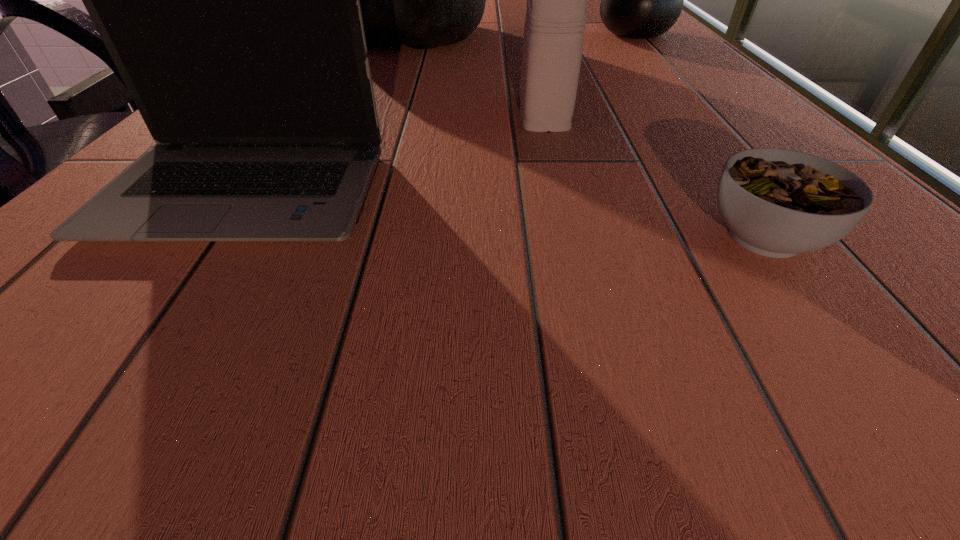
The image size is (960, 540). What are the coordinates of `vacant area that lies between the soup bowl and the second tallest object` in the screenshot? It's located at (700, 136).

The width and height of the screenshot is (960, 540). What are the coordinates of `empty space between the soup bowl and the third object from right to left` in the screenshot? It's located at (654, 174).

The height and width of the screenshot is (540, 960). I want to click on vacant region between the detergent and the laptop computer, so click(394, 153).

Identify the location of free area in between the soup bowl and the third object from right to left. (654, 174).

Identify the location of free point between the vase and the laptop computer. The image size is (960, 540). (439, 114).

Where is `free space between the plastic bag and the vase`? The image size is (960, 540). free space between the plastic bag and the vase is located at coordinates (523, 33).

Find the location of `unoccupied area between the tallest object and the shortest object`. unoccupied area between the tallest object and the shortest object is located at coordinates (588, 134).

At what (x,y) coordinates should I click in order to perform the action: click on empty location between the detergent and the vase. Please return your answer as a coordinate pair (x, y). This screenshot has width=960, height=540. Looking at the image, I should click on [588, 73].

Find the location of a particular element. This screenshot has width=960, height=540. unoccupied area between the laptop computer and the second tallest object is located at coordinates (439, 114).

This screenshot has width=960, height=540. Find the location of `vacant space that's between the tallest object and the third nearest object`. vacant space that's between the tallest object and the third nearest object is located at coordinates (477, 71).